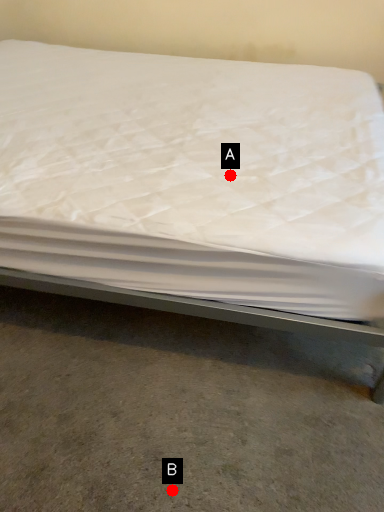
Question: Two points are circled on the image, labeled by A and B beside each circle. Among these points, which one is farthest from the camera?

Choices:
 (A) A is further
 (B) B is further

Answer: (A)